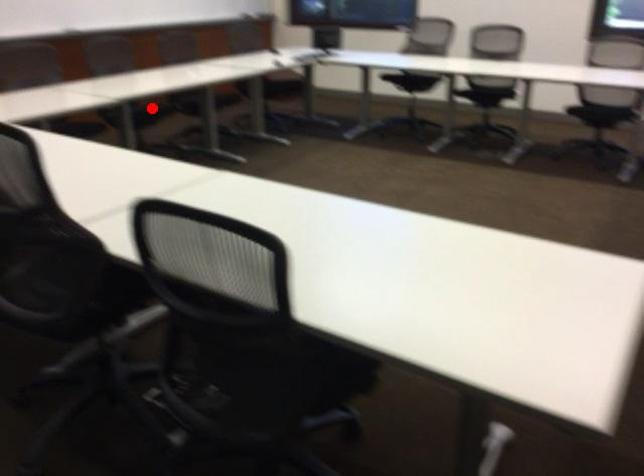
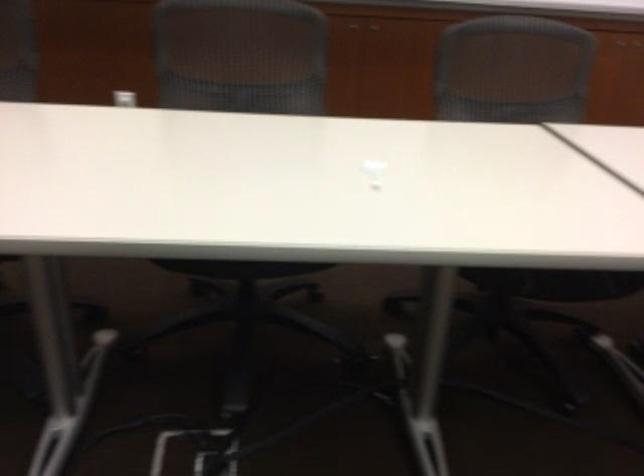
Find the pixel in the second image that matches the highlighted location in the first image.

(239, 268)